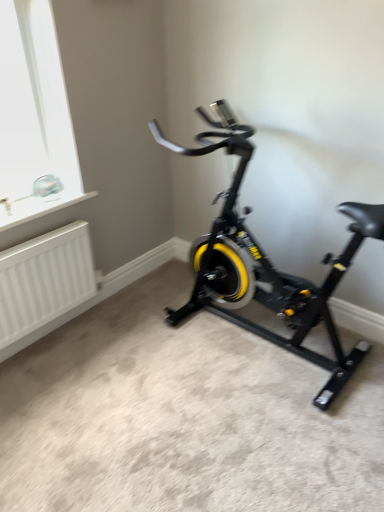
This screenshot has height=512, width=384. In order to click on vacant region below black matte stationary bicycle at center (from a real-world perspective) in this screenshot , I will do `click(271, 343)`.